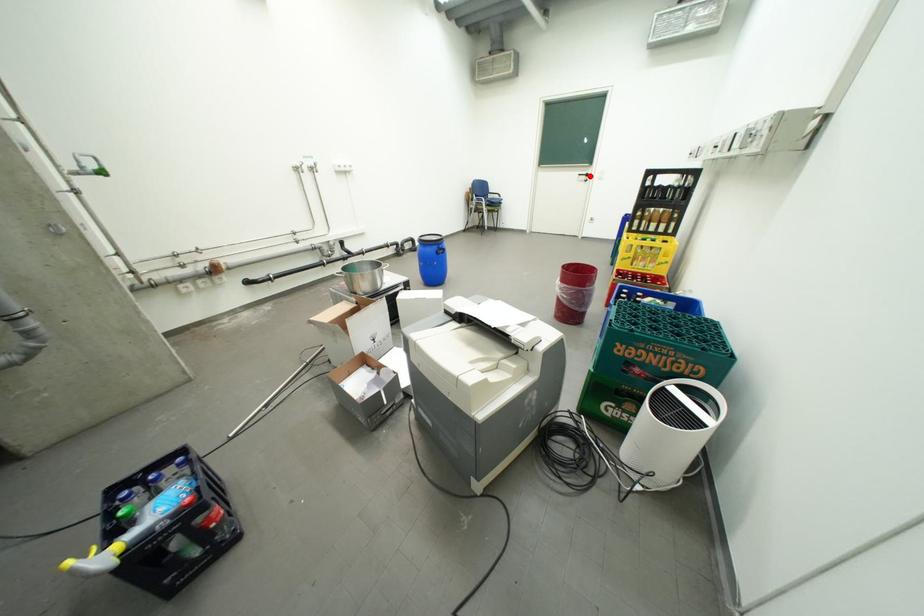
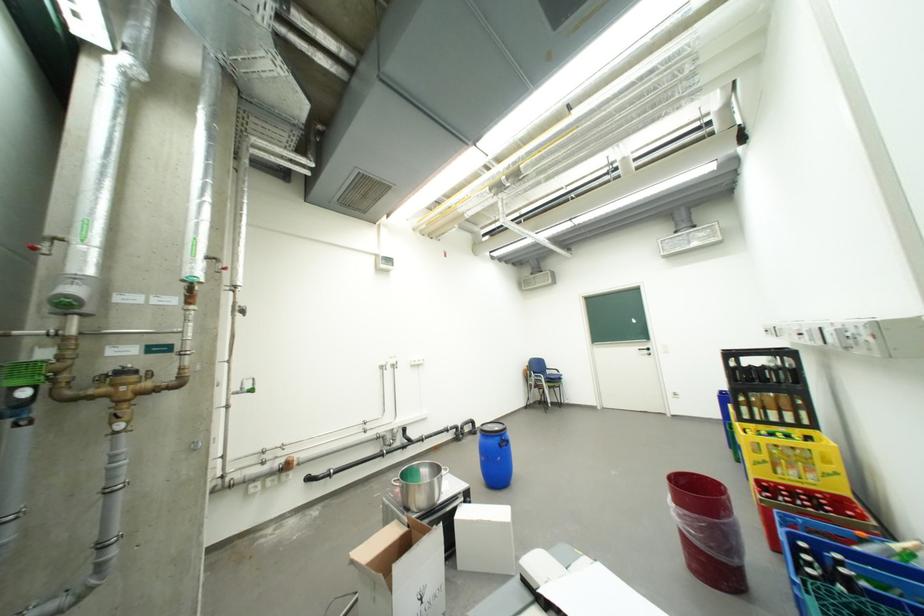
Question: I am providing you with two images of the same scene from different viewpoints. Image1 has a red point marked. In image2, the corresponding 3D location appears at what relative position? Reply with the corresponding letter.

Choices:
 (A) Closer
 (B) Farther

Answer: (B)